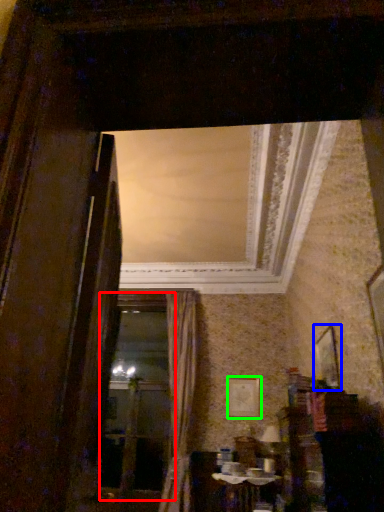
Question: Based on their relative distances, which object is farther from window frame (highlighted by a red box)? Choose from picture frame (highlighted by a blue box) and picture frame (highlighted by a green box).

Choices:
 (A) picture frame
 (B) picture frame

Answer: (A)